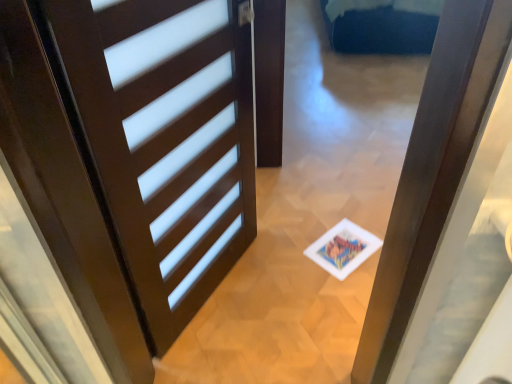
This screenshot has height=384, width=512. Describe the element at coordinates (167, 140) in the screenshot. I see `dark wood door at center` at that location.

Where is `dark wood door at center`? This screenshot has width=512, height=384. dark wood door at center is located at coordinates (167, 140).

Identify the location of dark wood door at center. (167, 140).